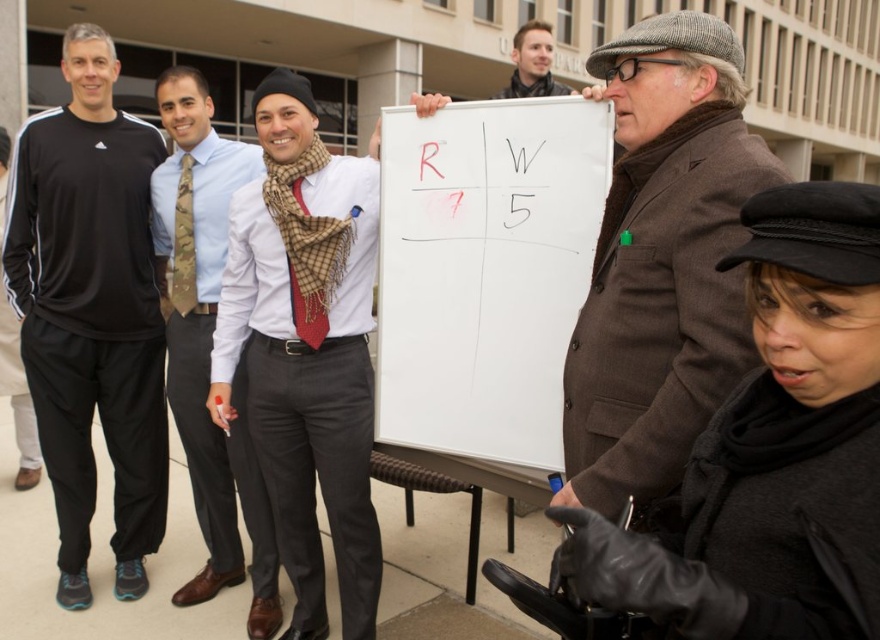
You are observing a group of people outside a building. There is a whiteboard with sections labeled R and W, and a person wearing a camo tie at center. Based on the coordinates provided in the Objects Description, is the camo tie closer to the top or bottom of the image?

The camo tie at center is located at point [207,339]. Since the y coordinate is 0.236, which is closer to 0.0 than 1.0, it means the camo tie is closer to the top of the image.

You are part of the group observing the white matte board at center and the brown wool coat at center. Which object is taller?

The brown wool coat at center is taller than the white matte board at center.

You are part of the group observing the white matte board at center and the brown wool coat at center. Which object is located to the left of the other?

The white matte board at center is positioned on the left side of brown wool coat at center.